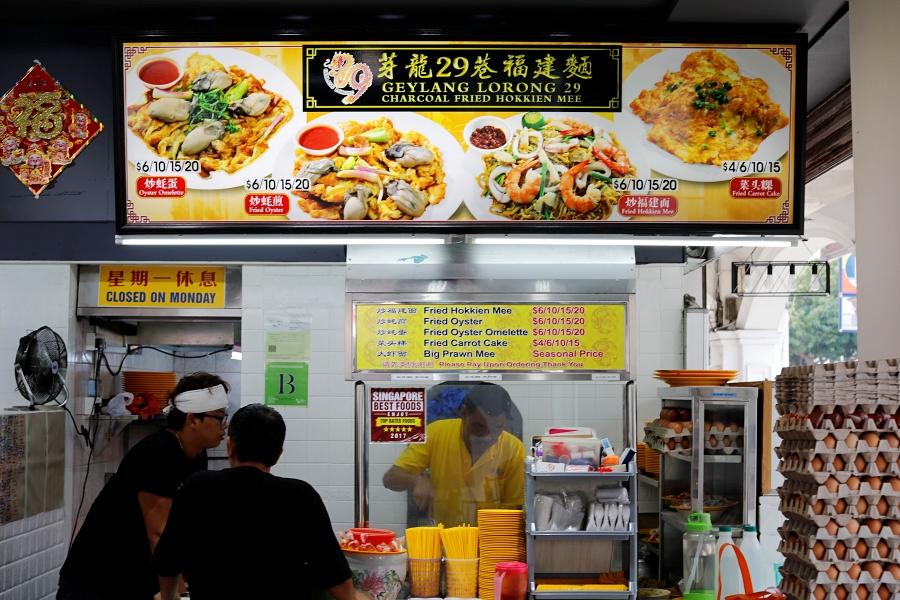
At what (x,y) coordinates should I click in order to perform the action: click on white wall. Please return your answer as a coordinate pair (x, y). Image resolution: width=900 pixels, height=600 pixels. Looking at the image, I should click on (321, 442).